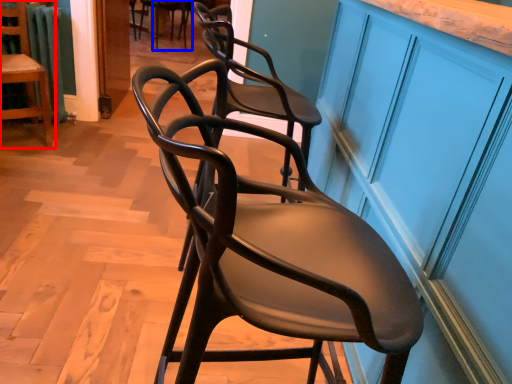
Question: Which object appears farthest to the camera in this image, chair (highlighted by a red box) or chair (highlighted by a blue box)?

Choices:
 (A) chair
 (B) chair

Answer: (B)